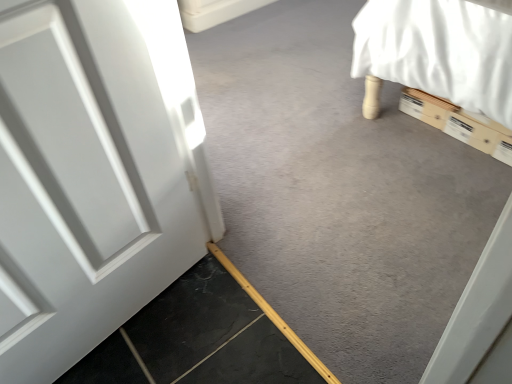
At what (x,y) coordinates should I click in order to perform the action: click on empty space that is ontop of smooth gray concrete at lower left, the second concrete in the bottom-to-top sequence (from a real-world perspective). Please return your answer as a coordinate pair (x, y). The image size is (512, 384). Looking at the image, I should click on (332, 139).